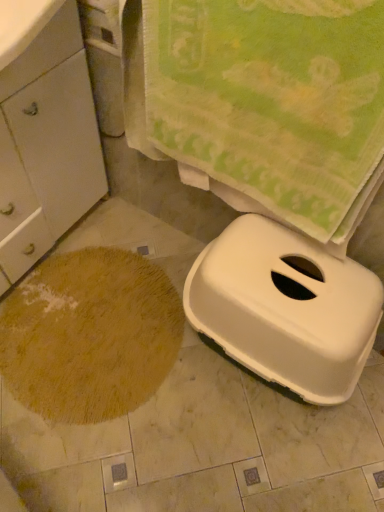
Question: Considering their positions, is brown shaggy rug at lower left located in front of or behind green textured towel at upper center?

Choices:
 (A) front
 (B) behind

Answer: (B)

Question: Looking at their shapes, would you say brown shaggy rug at lower left is wider or thinner than green textured towel at upper center?

Choices:
 (A) thin
 (B) wide

Answer: (B)

Question: Which object is the farthest from the green textured towel at upper center?

Choices:
 (A) white plastic litter box at lower right
 (B) white matte cabinet at left
 (C) brown shaggy rug at lower left

Answer: (C)

Question: Estimate the real-world distances between objects in this image. Which object is closer to the white matte cabinet at left?

Choices:
 (A) brown shaggy rug at lower left
 (B) green textured towel at upper center
 (C) white plastic litter box at lower right

Answer: (A)